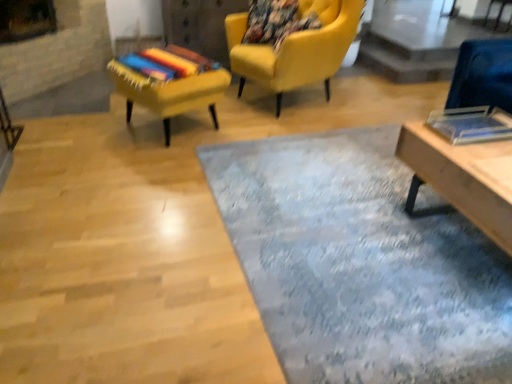
This screenshot has height=384, width=512. In order to click on matte yellow armchair at upper center, acting as the 2th chair starting from the left in this screenshot , I will do `click(296, 49)`.

Describe the element at coordinates (465, 169) in the screenshot. I see `wooden table at lower right` at that location.

This screenshot has width=512, height=384. Describe the element at coordinates (169, 82) in the screenshot. I see `textured yellow chair at upper left, which appears as the 2th chair when viewed from the right` at that location.

Identify the location of matte yellow armchair at upper center, acting as the 2th chair starting from the left. Image resolution: width=512 pixels, height=384 pixels. (296, 49).

From the image's perspective, is matte yellow armchair at upper center, acting as the 2th chair starting from the left, positioned above or below transparent glass table at upper right?

From the image's perspective, matte yellow armchair at upper center, acting as the 2th chair starting from the left, appears below transparent glass table at upper right.

Is matte yellow armchair at upper center, acting as the 2th chair starting from the left, aimed at transparent glass table at upper right?

No, matte yellow armchair at upper center, acting as the 2th chair starting from the left, is not oriented towards transparent glass table at upper right.

Considering the sizes of objects matte yellow armchair at upper center, arranged as the first chair when viewed from the right, and transparent glass table at upper right in the image provided, who is taller, matte yellow armchair at upper center, arranged as the first chair when viewed from the right, or transparent glass table at upper right?

With more height is matte yellow armchair at upper center, arranged as the first chair when viewed from the right.

Where is `table that appears below the textured yellow chair at upper left, which appears as the 2th chair when viewed from the right (from the image's perspective)`? Image resolution: width=512 pixels, height=384 pixels. table that appears below the textured yellow chair at upper left, which appears as the 2th chair when viewed from the right (from the image's perspective) is located at coordinates tap(465, 169).

Considering the sizes of objects wooden table at lower right and textured yellow chair at upper left, which is the first chair from left to right, in the image provided, who is bigger, wooden table at lower right or textured yellow chair at upper left, which is the first chair from left to right,?

Bigger between the two is wooden table at lower right.

Which is behind, point (410, 163) or point (192, 105)?

The point (192, 105) is farther from the camera.

Does wooden table at lower right have a greater height compared to textured yellow chair at upper left, which is the first chair from left to right?

Yes.

Is matte yellow armchair at upper center, acting as the 2th chair starting from the left, far from textured blue rug at center?

Indeed, matte yellow armchair at upper center, acting as the 2th chair starting from the left, is not near textured blue rug at center.

From the image's perspective, is matte yellow armchair at upper center, arranged as the first chair when viewed from the right, located beneath textured blue rug at center?

No, from the image's perspective, matte yellow armchair at upper center, arranged as the first chair when viewed from the right, is not beneath textured blue rug at center.

Is matte yellow armchair at upper center, acting as the 2th chair starting from the left, smaller than textured blue rug at center?

Actually, matte yellow armchair at upper center, acting as the 2th chair starting from the left, might be larger than textured blue rug at center.

Can you tell me how much matte yellow armchair at upper center, acting as the 2th chair starting from the left, and textured blue rug at center differ in facing direction?

The angular difference between matte yellow armchair at upper center, acting as the 2th chair starting from the left, and textured blue rug at center is 111 degrees.

Would you say transparent glass table at upper right is a long distance from textured blue rug at center?

transparent glass table at upper right is positioned a significant distance from textured blue rug at center.

Is transparent glass table at upper right facing towards textured blue rug at center?

No, transparent glass table at upper right is not facing towards textured blue rug at center.

Is transparent glass table at upper right taller than textured blue rug at center?

Correct, transparent glass table at upper right is much taller as textured blue rug at center.

Considering their positions, is transparent glass table at upper right located in front of or behind textured blue rug at center?

Visually, transparent glass table at upper right is located behind textured blue rug at center.

Is transparent glass table at upper right bigger than matte yellow armchair at upper center, acting as the 2th chair starting from the left?

Incorrect, transparent glass table at upper right is not larger than matte yellow armchair at upper center, acting as the 2th chair starting from the left.

Based on the photo, is matte yellow armchair at upper center, acting as the 2th chair starting from the left, completely or partially inside transparent glass table at upper right?

That's incorrect, matte yellow armchair at upper center, acting as the 2th chair starting from the left, is not inside transparent glass table at upper right.

This screenshot has height=384, width=512. What are the coordinates of `glass table behind the matte yellow armchair at upper center, arranged as the first chair when viewed from the right` in the screenshot? It's located at (415, 41).

Is transparent glass table at upper right next to matte yellow armchair at upper center, acting as the 2th chair starting from the left?

They are not placed beside each other.

Is point (336, 57) less distant than point (167, 58)?

That is False.

Could you tell me if matte yellow armchair at upper center, acting as the 2th chair starting from the left, is facing textured yellow chair at upper left, which is the first chair from left to right?

Yes, matte yellow armchair at upper center, acting as the 2th chair starting from the left, is oriented towards textured yellow chair at upper left, which is the first chair from left to right.

Which of these two, matte yellow armchair at upper center, arranged as the first chair when viewed from the right, or textured yellow chair at upper left, which is the first chair from left to right, stands shorter?

With less height is textured yellow chair at upper left, which is the first chair from left to right.

Considering the positions of objects matte yellow armchair at upper center, acting as the 2th chair starting from the left, and textured yellow chair at upper left, which appears as the 2th chair when viewed from the right, in the image provided, who is more to the right, matte yellow armchair at upper center, acting as the 2th chair starting from the left, or textured yellow chair at upper left, which appears as the 2th chair when viewed from the right,?

Positioned to the right is matte yellow armchair at upper center, acting as the 2th chair starting from the left.

Is wooden table at lower right at the back of transparent glass table at upper right?

transparent glass table at upper right does not have its back to wooden table at lower right.

The width and height of the screenshot is (512, 384). Find the location of `glass table located above the wooden table at lower right (from the image's perspective)`. glass table located above the wooden table at lower right (from the image's perspective) is located at coordinates (415, 41).

Does point (376, 23) lie behind point (464, 202)?

Yes, it is behind point (464, 202).

From a real-world perspective, is transparent glass table at upper right positioned under wooden table at lower right based on gravity?

Yes.

Where is `the 1st chair in front of the transparent glass table at upper right`? This screenshot has width=512, height=384. the 1st chair in front of the transparent glass table at upper right is located at coordinates (296, 49).

Identify the location of table to the right of textured yellow chair at upper left, which appears as the 2th chair when viewed from the right. (465, 169).

From the image, which object appears to be nearer to wooden table at lower right, transparent glass table at upper right or textured blue rug at center?

Among the two, textured blue rug at center is located nearer to wooden table at lower right.

From the image, which object appears to be farther from textured yellow chair at upper left, which is the first chair from left to right, wooden table at lower right or transparent glass table at upper right?

The object further to textured yellow chair at upper left, which is the first chair from left to right, is transparent glass table at upper right.

Consider the image. Based on their spatial positions, is wooden table at lower right or textured blue rug at center further from transparent glass table at upper right?

Based on the image, textured blue rug at center appears to be further to transparent glass table at upper right.

From the image, which object appears to be farther from wooden table at lower right, textured yellow chair at upper left, which appears as the 2th chair when viewed from the right, or transparent glass table at upper right?

The object further to wooden table at lower right is transparent glass table at upper right.

When comparing their distances from textured yellow chair at upper left, which appears as the 2th chair when viewed from the right, does wooden table at lower right or matte yellow armchair at upper center, arranged as the first chair when viewed from the right, seem closer?

The object closer to textured yellow chair at upper left, which appears as the 2th chair when viewed from the right, is matte yellow armchair at upper center, arranged as the first chair when viewed from the right.

From the image, which object appears to be farther from wooden table at lower right, matte yellow armchair at upper center, arranged as the first chair when viewed from the right, or transparent glass table at upper right?

Based on the image, transparent glass table at upper right appears to be further to wooden table at lower right.

Which object lies nearer to the anchor point matte yellow armchair at upper center, acting as the 2th chair starting from the left, textured yellow chair at upper left, which is the first chair from left to right, or transparent glass table at upper right?

The object closer to matte yellow armchair at upper center, acting as the 2th chair starting from the left, is textured yellow chair at upper left, which is the first chair from left to right.

Looking at the image, which one is located closer to textured yellow chair at upper left, which appears as the 2th chair when viewed from the right, textured blue rug at center or wooden table at lower right?

textured blue rug at center.

Image resolution: width=512 pixels, height=384 pixels. I want to click on table located between textured blue rug at center and transparent glass table at upper right in the depth direction, so (x=465, y=169).

Identify the location of mat situated between textured yellow chair at upper left, which is the first chair from left to right, and wooden table at lower right from left to right. (360, 263).

This screenshot has height=384, width=512. I want to click on chair between textured blue rug at center and matte yellow armchair at upper center, acting as the 2th chair starting from the left, from front to back, so click(169, 82).

What are the coordinates of `chair between textured yellow chair at upper left, which appears as the 2th chair when viewed from the right, and wooden table at lower right, in the horizontal direction` in the screenshot? It's located at (296, 49).